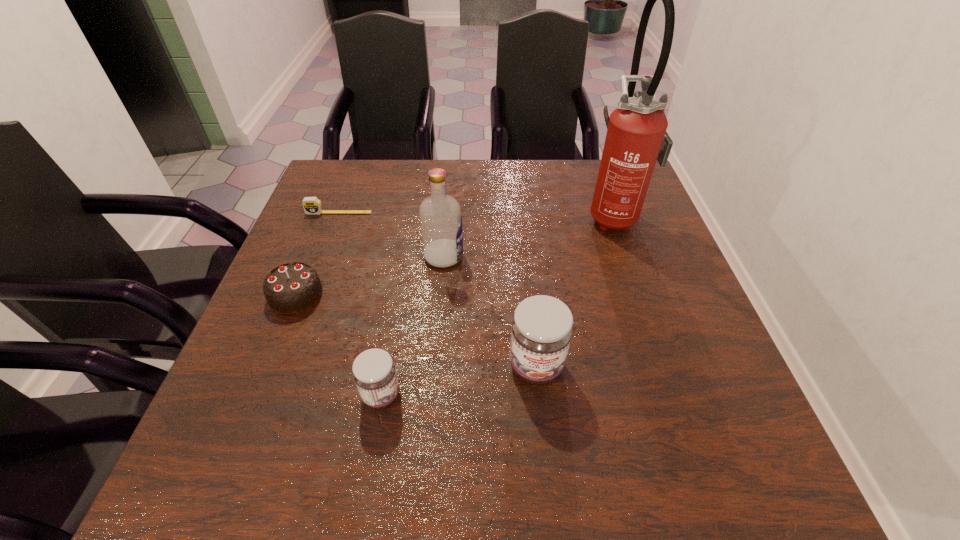
Where is `the third nearest object`? the third nearest object is located at coordinates (291, 288).

This screenshot has height=540, width=960. Identify the location of free location located on the front label of the fourth object from right to left. (528, 395).

Where is `free point located 0.390m on the label of the second tallest object`? This screenshot has width=960, height=540. free point located 0.390m on the label of the second tallest object is located at coordinates (625, 256).

At what (x,y) coordinates should I click in order to perform the action: click on free space located at the nozzle of the fire extinguisher. Please return your answer as a coordinate pair (x, y). This screenshot has width=960, height=540. Looking at the image, I should click on 460,215.

Where is `vacant point located at the nozzle of the fire extinguisher`? This screenshot has height=540, width=960. vacant point located at the nozzle of the fire extinguisher is located at coordinates (512, 215).

Identify the location of vacant point located 0.050m at the nozzle of the fire extinguisher. (568, 215).

I want to click on vacant space located at the front of the tape measure with the tape extended, so click(319, 266).

Locate an element on the screen. Image resolution: width=960 pixels, height=540 pixels. free space located on the right of the third nearest object is located at coordinates (440, 295).

Find the location of a particular element. object at the far edge is located at coordinates (636, 138).

Locate an element on the screen. Image resolution: width=960 pixels, height=540 pixels. tape measure that is at the left edge is located at coordinates 312,205.